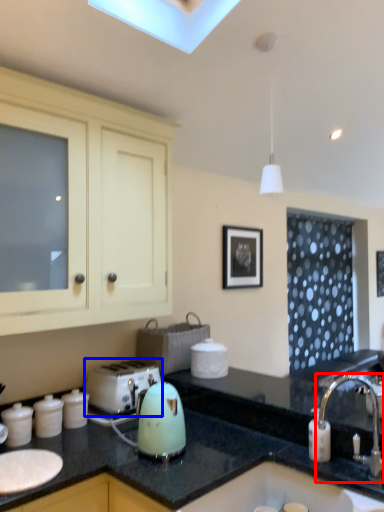
Question: Which of the following is the closest to the observer, tap (highlighted by a red box) or toaster (highlighted by a blue box)?

Choices:
 (A) tap
 (B) toaster

Answer: (A)